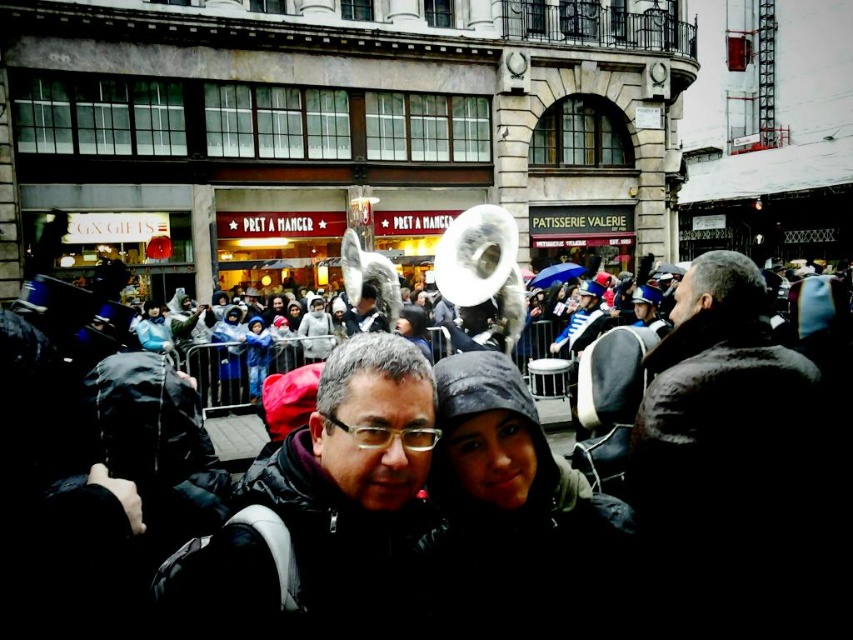
Question: Does dark gray jacket at center appear over dark gray hooded jacket at center?

Choices:
 (A) yes
 (B) no

Answer: (B)

Question: Based on their relative distances, which object is farther from the dark gray hooded jacket at center?

Choices:
 (A) matte blue jacket at center
 (B) dark gray jacket at center
 (C) brown fuzzy coat at center
 (D) silver metallic tuba at center

Answer: (A)

Question: Is brown fuzzy coat at center to the left of dark gray jacket at center from the viewer's perspective?

Choices:
 (A) no
 (B) yes

Answer: (A)

Question: Among these objects, which one is farthest from the camera?

Choices:
 (A) matte blue jacket at center
 (B) silver metallic tuba at center
 (C) blue fleece jacket at center
 (D) dark gray hooded jacket at center

Answer: (B)

Question: Is brown fuzzy coat at center to the right of dark gray hooded jacket at center from the viewer's perspective?

Choices:
 (A) yes
 (B) no

Answer: (A)

Question: Which of the following is the closest to the observer?

Choices:
 (A) matte blue jacket at center
 (B) blue fleece jacket at center
 (C) brown fuzzy coat at center

Answer: (C)